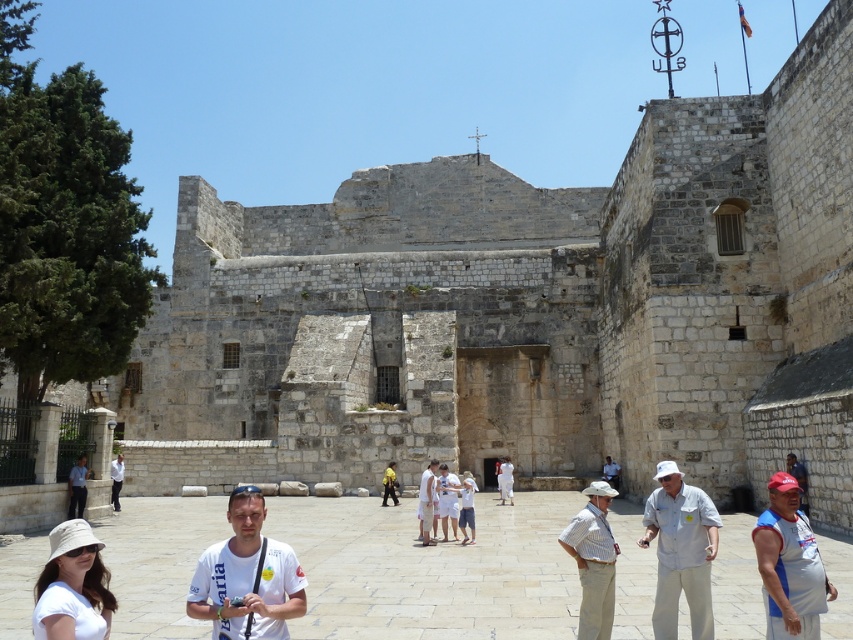
Question: Can you confirm if white cotton t-shirt at center is positioned to the left of striped cotton shirt at center?

Choices:
 (A) no
 (B) yes

Answer: (B)

Question: Which of the following is the farthest from the observer?

Choices:
 (A) (242, 573)
 (B) (67, 516)
 (C) (241, 406)

Answer: (C)

Question: Can you confirm if light blue shirt at lower left is positioned above yellow fabric backpack at center?

Choices:
 (A) yes
 (B) no

Answer: (A)

Question: Can you confirm if white cotton t-shirt at center is positioned to the left of white matte hat at lower left?

Choices:
 (A) yes
 (B) no

Answer: (B)

Question: Which of the following is the farthest from the observer?

Choices:
 (A) (193, 582)
 (B) (384, 476)
 (C) (68, 564)
 (D) (85, 488)

Answer: (B)

Question: Which point is farther to the camera?

Choices:
 (A) (840, 32)
 (B) (590, 557)

Answer: (A)